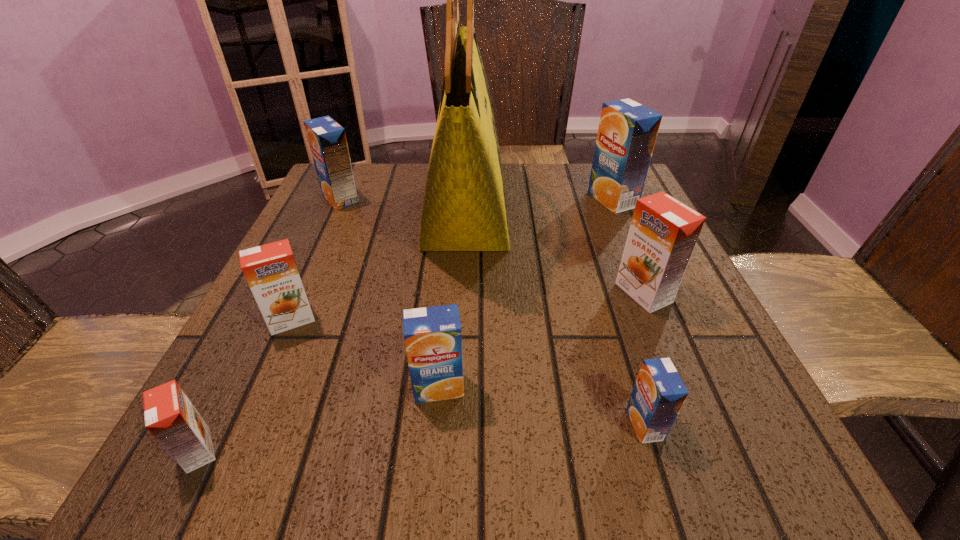
This screenshot has width=960, height=540. I want to click on tote bag that is at the far edge, so click(464, 208).

You are a GUI agent. You are given a task and a screenshot of the screen. Output one action in this format:
    pyautogui.click(x=<x>, y=<y>)
    Task: Click on the object that is positioned at the far left corner
    This screenshot has width=960, height=540.
    Given the screenshot: What is the action you would take?
    pyautogui.click(x=327, y=139)

Identify the location of object that is at the near left corner. This screenshot has height=540, width=960. (170, 417).

At what (x,y) coordinates should I click in order to perform the action: click on object that is at the far right corner. Please return your answer as a coordinate pair (x, y). The height and width of the screenshot is (540, 960). Looking at the image, I should click on (627, 132).

Locate an element on the screen. The image size is (960, 540). object positioned at the near right corner is located at coordinates (659, 393).

The height and width of the screenshot is (540, 960). Find the location of `free space at the far edge of the desktop`. free space at the far edge of the desktop is located at coordinates (417, 202).

This screenshot has width=960, height=540. I want to click on vacant space at the left edge, so click(x=341, y=249).

Where is `free location at the right edge of the desktop`? This screenshot has width=960, height=540. free location at the right edge of the desktop is located at coordinates (650, 331).

Identify the location of vacant space at the far left corner of the desktop. (305, 211).

In the image, there is a desktop. Where is `vacant space at the far right corner`? This screenshot has height=540, width=960. vacant space at the far right corner is located at coordinates (643, 197).